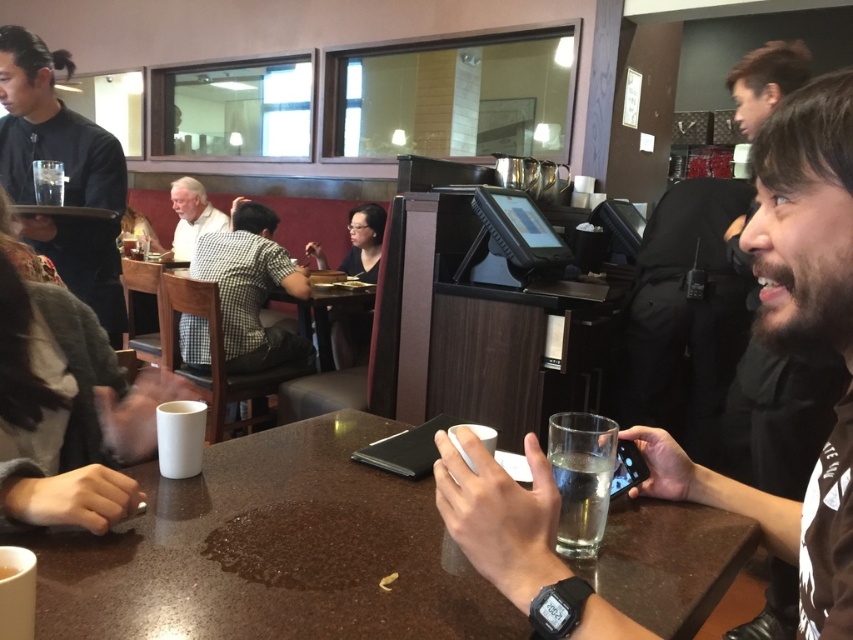
You are a waiter in a restaurant and need to place a new order of drinks on the table. The table has a clear glass at center and a smooth brown shirt at right. Where should you place the drinks to avoid the shirt?

The smooth brown shirt at right is to the right of the clear glass at center, so placing the drinks to the left of the clear glass at center would avoid the shirt.

You are a waiter in a restaurant and need to place a new order of a salad plate that is 20 cm wide on the table. The black matte tray at upper left and the clear glass at center are currently on the table. Can you place the salad plate on the table without moving any existing items?

The black matte tray at upper left might be wider than clear glass at center, but since the salad plate is 20 cm wide, it is possible that there is enough space on the table between or around the existing items to accommodate it. However, without knowing the exact dimensions of the tray and glass, it is uncertain if the salad plate will fit without moving any items.

You are a waiter in the restaurant. You need to place a new order of a tall dessert between the smooth brown shirt at right and the clear glass at center. Where should you place it so it doesn t fall off the table?

The smooth brown shirt at right is taller than the clear glass at center, so placing the dessert between them towards the side of the clear glass at center would prevent it from falling since the shirt is taller and can act as a barrier.